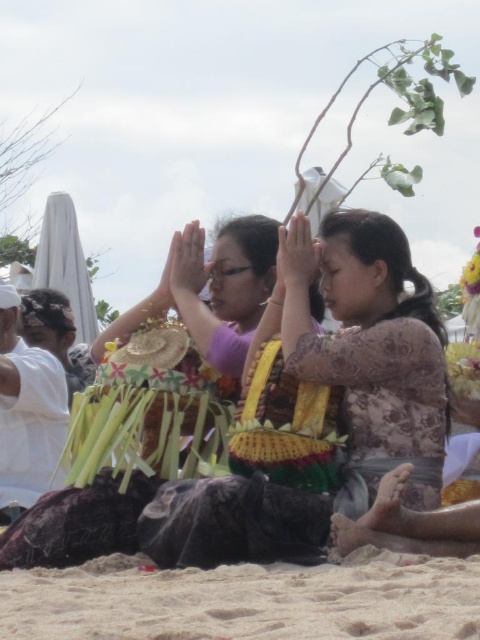
Question: Is sandy beach at lower center thinner than patterned silk dress at center?

Choices:
 (A) yes
 (B) no

Answer: (B)

Question: Which of the following is the closest to the observer?

Choices:
 (A) (298, 568)
 (B) (405, 307)

Answer: (A)

Question: In this image, where is sandy beach at lower center located relative to patterned silk dress at center?

Choices:
 (A) left
 (B) right

Answer: (A)

Question: Does sandy beach at lower center have a smaller size compared to patterned silk dress at center?

Choices:
 (A) no
 (B) yes

Answer: (B)

Question: Which of the following is the closest to the observer?

Choices:
 (A) (319, 586)
 (B) (396, 452)

Answer: (A)